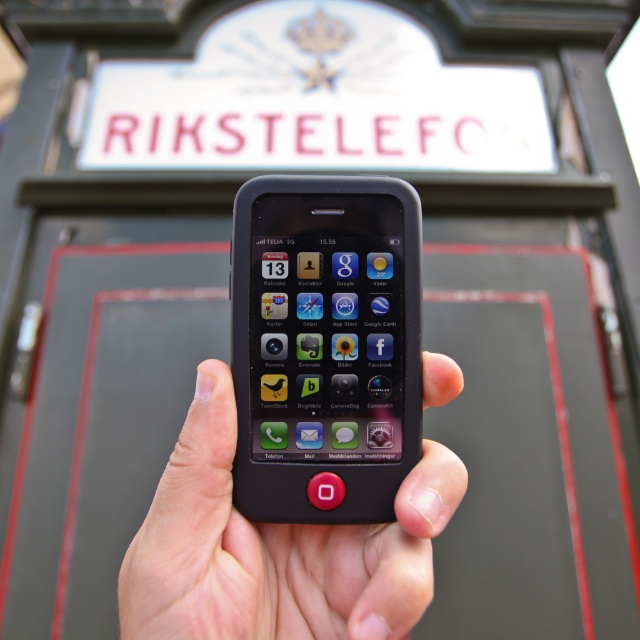
Question: Is black matte smartphone at center wider than black matte phone at center?

Choices:
 (A) yes
 (B) no

Answer: (B)

Question: Which point appears farthest from the camera in this image?

Choices:
 (A) (252, 208)
 (B) (177, 616)

Answer: (A)

Question: Does black matte smartphone at center appear under black matte phone at center?

Choices:
 (A) no
 (B) yes

Answer: (A)

Question: Can you confirm if black matte smartphone at center is thinner than black matte phone at center?

Choices:
 (A) no
 (B) yes

Answer: (B)